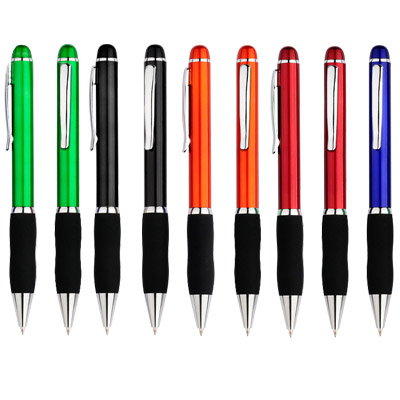
Identify the location of number of pens. (20, 171), (58, 173), (96, 173), (146, 172), (199, 174), (244, 177), (283, 177), (329, 178), (388, 181).